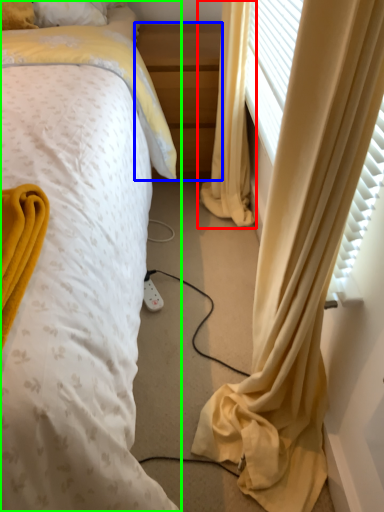
Question: Which object is the closest to the curtain (highlighted by a red box)? Choose among these: nightstand (highlighted by a blue box) or bed (highlighted by a green box).

Choices:
 (A) nightstand
 (B) bed

Answer: (A)